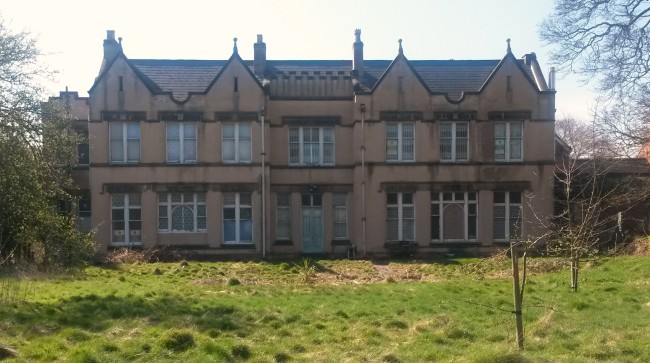
Identify the location of door. pos(303,242).